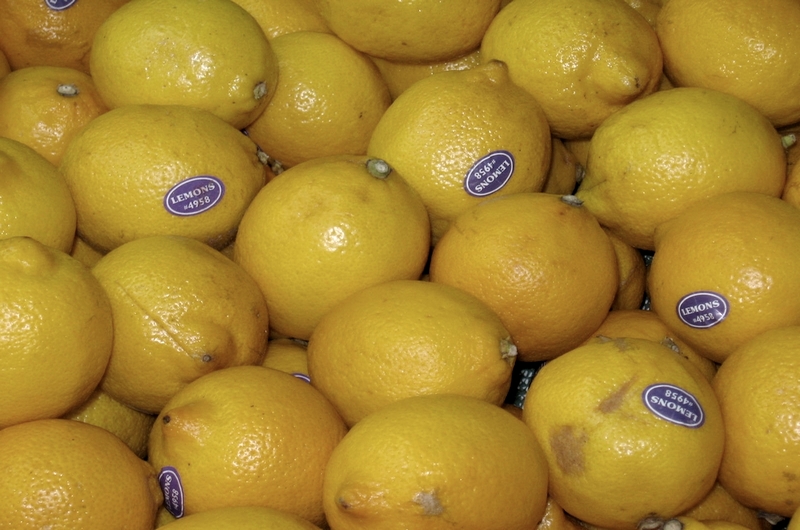
Where is `stickers`? stickers is located at coordinates (173, 475), (301, 373), (200, 190), (504, 163), (50, 3), (706, 315), (677, 412).